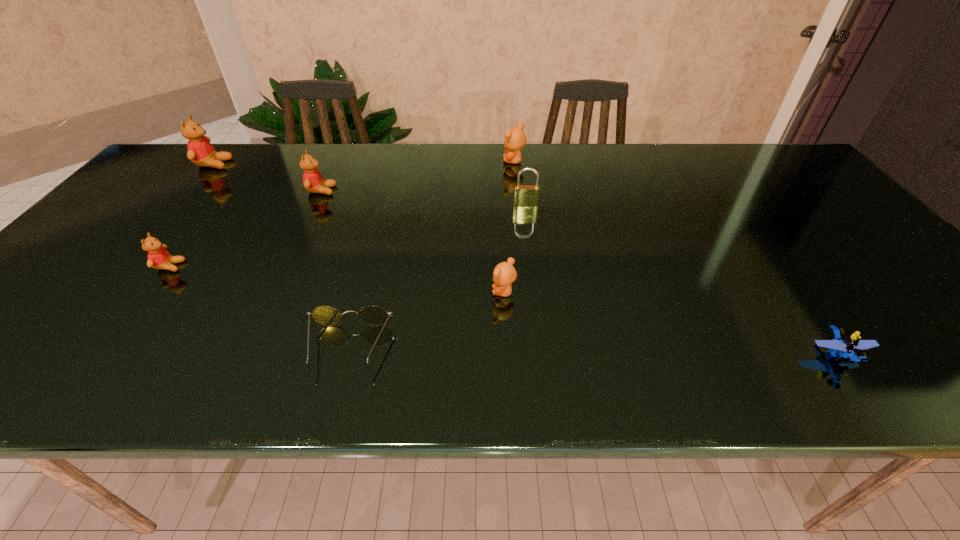
Where is `the second nearest teddy bear`? The height and width of the screenshot is (540, 960). the second nearest teddy bear is located at coordinates (158, 257).

Where is `blue Lego`? This screenshot has width=960, height=540. blue Lego is located at coordinates (846, 344).

Identify the location of the rightmost object. (846, 344).

Where is `yellow spectacles`? yellow spectacles is located at coordinates coord(371,315).

Find the location of `the fifth object from right to left`. the fifth object from right to left is located at coordinates (371, 315).

The image size is (960, 540). I want to click on vacant space located 0.050m on the front-facing side of the tallest teddy bear, so click(246, 164).

Identify the location of vacant space located on the front-facing side of the third farthest object. (415, 191).

Image resolution: width=960 pixels, height=540 pixels. What are the coordinates of `vacant space located on the face of the bigger brown teddy bear` in the screenshot? It's located at (459, 161).

The height and width of the screenshot is (540, 960). In order to click on vacant space located 0.360m on the face of the bigger brown teddy bear in this screenshot , I will do `click(389, 161)`.

At what (x,y) coordinates should I click in order to perform the action: click on free spot located on the face of the bigger brown teddy bear. Please return your answer as a coordinate pair (x, y). This screenshot has width=960, height=540. Looking at the image, I should click on (389, 161).